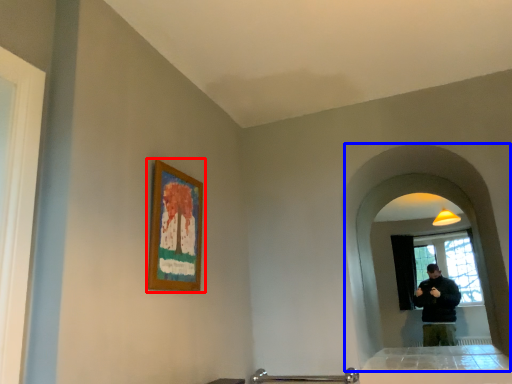
Question: Which object is further to the camera taking this photo, picture frame (highlighted by a red box) or mirror (highlighted by a blue box)?

Choices:
 (A) picture frame
 (B) mirror

Answer: (B)